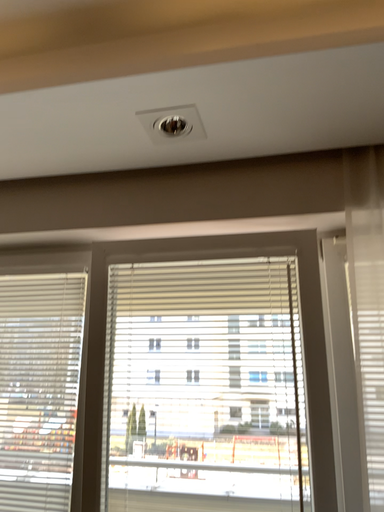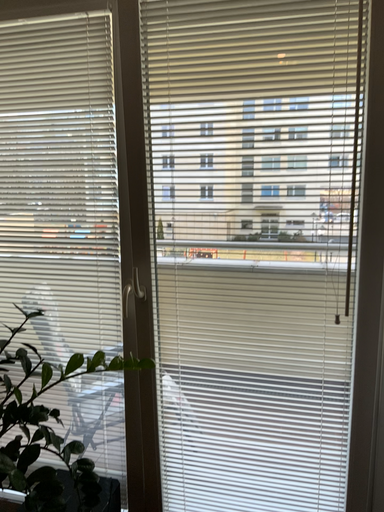
Question: How did the camera likely rotate when shooting the video?

Choices:
 (A) rotated upward
 (B) rotated downward

Answer: (B)